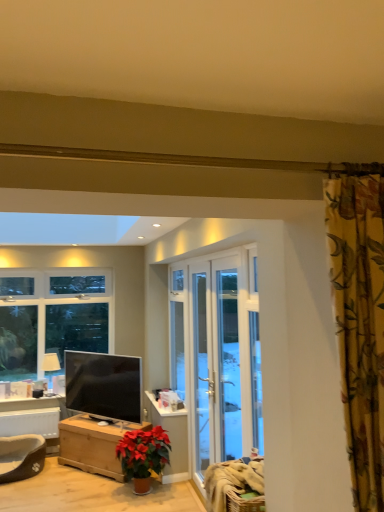
Question: Is white painted wood table at lower left smaller than matte black tv at lower left?

Choices:
 (A) yes
 (B) no

Answer: (A)

Question: Considering the relative sizes of white painted wood table at lower left and matte black tv at lower left in the image provided, is white painted wood table at lower left taller than matte black tv at lower left?

Choices:
 (A) no
 (B) yes

Answer: (A)

Question: Can you confirm if white painted wood table at lower left is thinner than matte black tv at lower left?

Choices:
 (A) no
 (B) yes

Answer: (B)

Question: Is white painted wood table at lower left turned away from matte black tv at lower left?

Choices:
 (A) yes
 (B) no

Answer: (B)

Question: From a real-world perspective, is white painted wood table at lower left over matte black tv at lower left?

Choices:
 (A) yes
 (B) no

Answer: (B)

Question: Is white painted wood table at lower left in contact with matte black tv at lower left?

Choices:
 (A) yes
 (B) no

Answer: (B)

Question: From the image's perspective, is matte black tv at lower left over white painted wood table at lower left?

Choices:
 (A) yes
 (B) no

Answer: (A)

Question: Does matte black tv at lower left lie in front of white painted wood table at lower left?

Choices:
 (A) no
 (B) yes

Answer: (B)

Question: Is matte black tv at lower left oriented towards white painted wood table at lower left?

Choices:
 (A) no
 (B) yes

Answer: (A)

Question: Is matte black tv at lower left positioned behind white painted wood table at lower left?

Choices:
 (A) no
 (B) yes

Answer: (A)

Question: Can you confirm if matte black tv at lower left is bigger than white painted wood table at lower left?

Choices:
 (A) no
 (B) yes

Answer: (B)

Question: Is matte black tv at lower left facing away from white painted wood table at lower left?

Choices:
 (A) no
 (B) yes

Answer: (A)

Question: Is dark brown plush pet bed at lower left further to the viewer compared to white glass door at center, the 2th screen door viewed from the front?

Choices:
 (A) no
 (B) yes

Answer: (B)